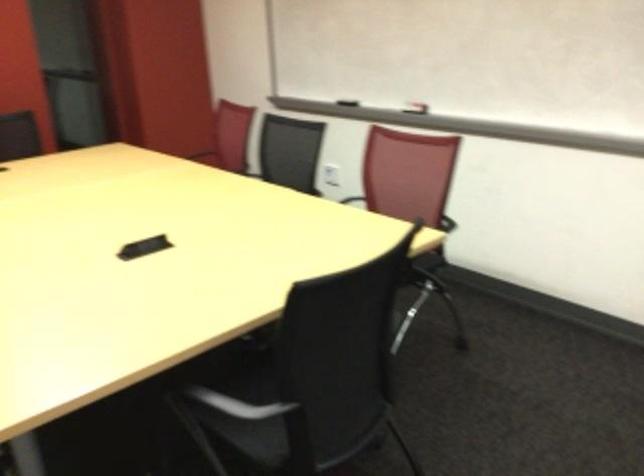
Find where to lift the whiteboard eraser. Please return your answer as a coordinate pair (x, y).

(346, 102)